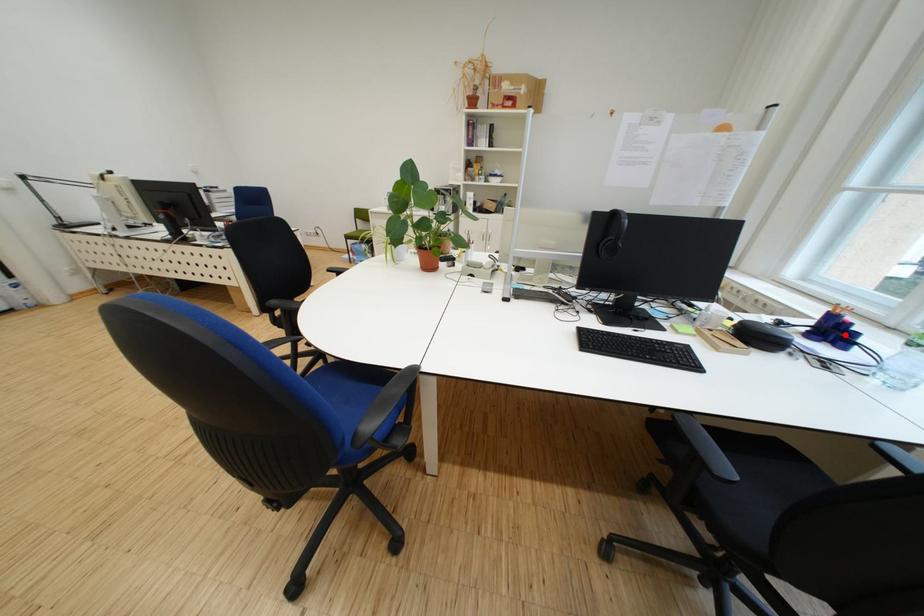
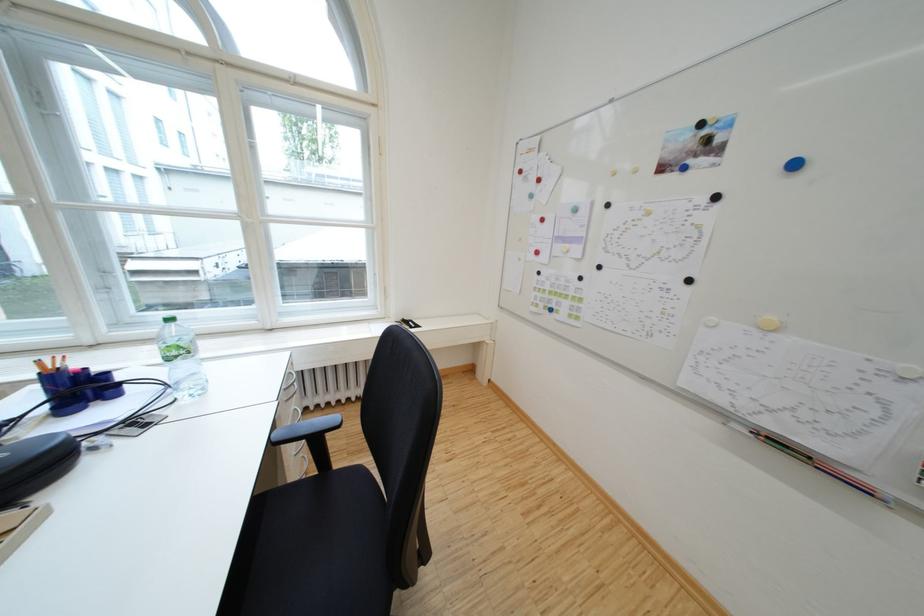
In the second image, find the point that corresponds to the highlighted location in the first image.

(94, 391)